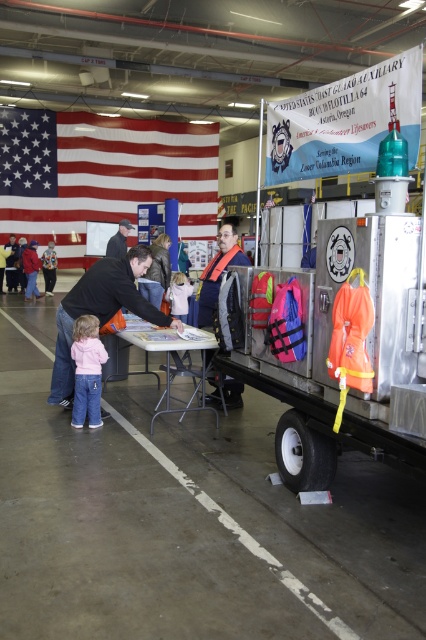
From the picture: Who is taller, white banner at upper center or white fleece jacket at center?

white banner at upper center

Is white banner at upper center wider than white fleece jacket at center?

Yes, white banner at upper center is wider than white fleece jacket at center.

Describe the element at coordinates (345, 122) in the screenshot. I see `white banner at upper center` at that location.

The width and height of the screenshot is (426, 640). I want to click on white banner at upper center, so click(x=345, y=122).

Between point (310, 140) and point (48, 243), which one is positioned behind?

The point (48, 243) is behind.

What do you see at coordinates (345, 122) in the screenshot? This screenshot has height=640, width=426. I see `white banner at upper center` at bounding box center [345, 122].

Where is `white banner at upper center`? The height and width of the screenshot is (640, 426). white banner at upper center is located at coordinates (345, 122).

What do you see at coordinates (86, 371) in the screenshot? The width and height of the screenshot is (426, 640). I see `pink fleece jacket at lower left` at bounding box center [86, 371].

Between pink fleece jacket at lower left and pink fabric jacket at lower left, which one appears on the left side from the viewer's perspective?

Positioned to the left is pink fabric jacket at lower left.

Is point (80, 369) more distant than point (54, 262)?

No, (80, 369) is closer to viewer.

What are the coordinates of `pink fleece jacket at lower left` in the screenshot? It's located at (86, 371).